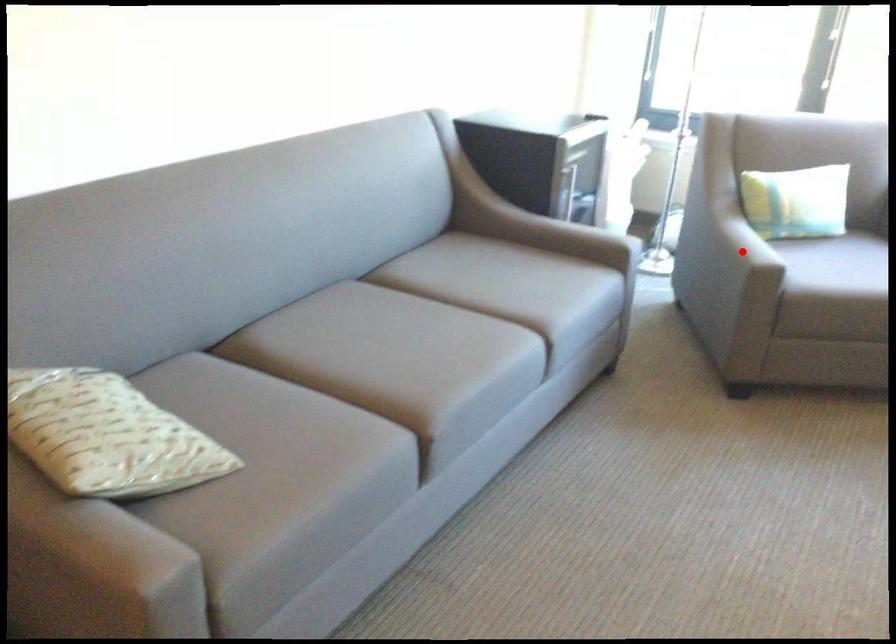
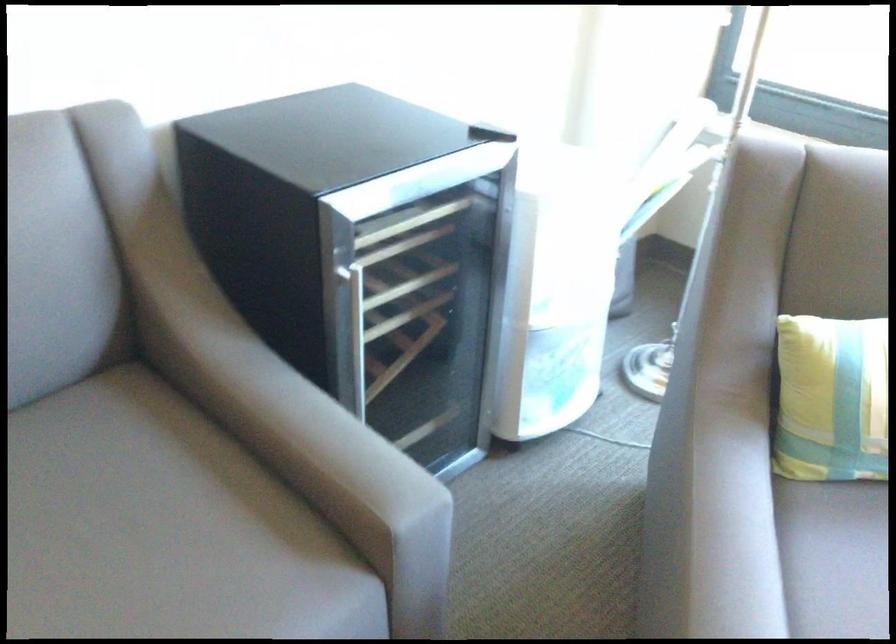
In the second image, find the point that corresponds to the highlighted location in the first image.

(837, 553)